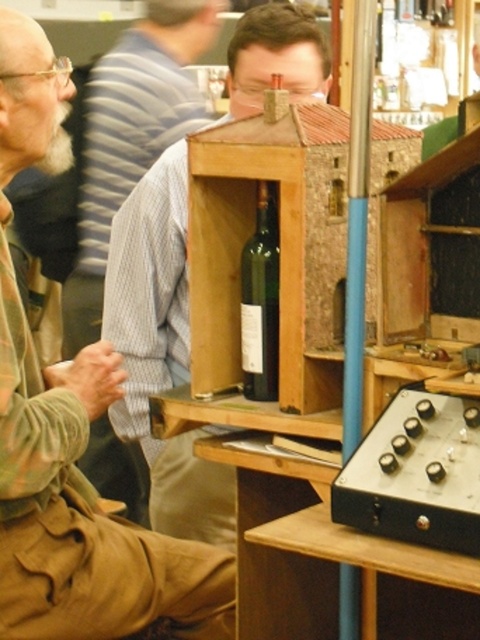
Question: Among these points, which one is nearest to the camera?

Choices:
 (A) (264, 380)
 (B) (72, 332)

Answer: (A)

Question: Can you confirm if light brown wood at center is positioned below light brown shirt at left?

Choices:
 (A) yes
 (B) no

Answer: (A)

Question: Which point is farther to the camera?

Choices:
 (A) white beard at left
 (B) light brown shirt at left
 (C) light brown wood at center
 (D) green glass bottle at center

Answer: (B)

Question: Does light brown shirt at left appear under green glass bottle at center?

Choices:
 (A) no
 (B) yes

Answer: (A)

Question: Which object is positioned closest to the white beard at left?

Choices:
 (A) light brown shirt at left
 (B) light brown wood at center
 (C) green glass bottle at center

Answer: (C)

Question: Is green glass bottle at center bigger than white beard at left?

Choices:
 (A) no
 (B) yes

Answer: (A)